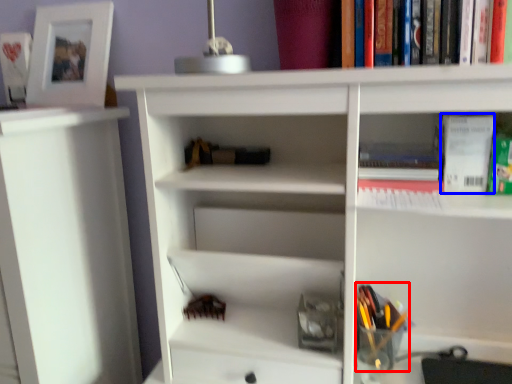
Question: Which object is closer to the camera taking this photo, stationery (highlighted by a red box) or paperback book (highlighted by a blue box)?

Choices:
 (A) stationery
 (B) paperback book

Answer: (B)